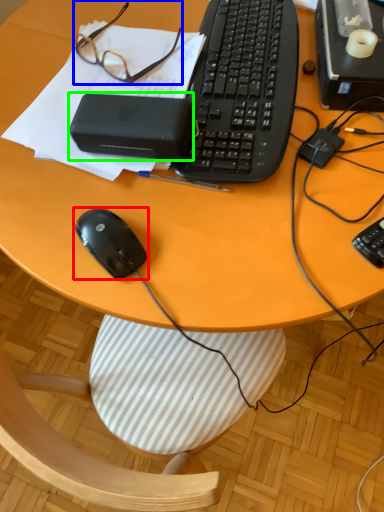
Question: Considering the real-world distances, which object is closest to mouse (highlighted by a red box)? glasses (highlighted by a blue box) or gadget (highlighted by a green box).

Choices:
 (A) glasses
 (B) gadget

Answer: (B)